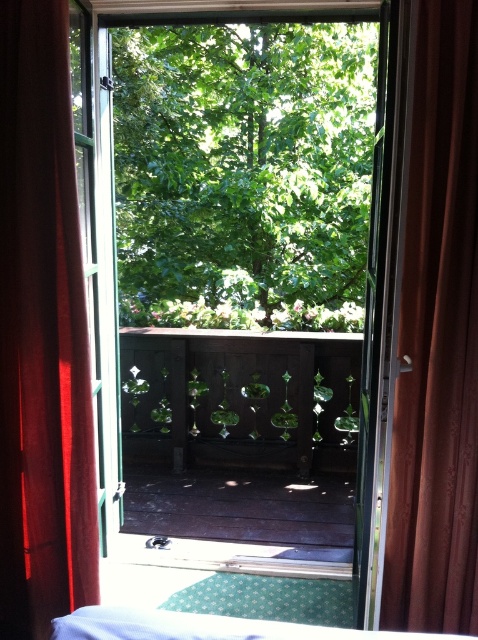
Does point (364, 131) come closer to viewer compared to point (393, 397)?

No, (364, 131) is behind (393, 397).

The image size is (478, 640). In order to click on green leafy tree at center in this screenshot , I will do `click(243, 173)`.

Does green leafy tree at center have a smaller size compared to white fabric bed at lower center?

Incorrect, green leafy tree at center is not smaller in size than white fabric bed at lower center.

Consider the image. Is green leafy tree at center to the left of white fabric bed at lower center from the viewer's perspective?

Correct, you'll find green leafy tree at center to the left of white fabric bed at lower center.

I want to click on green leafy tree at center, so click(x=243, y=173).

Between brown velvet curtain at right and white fabric bed at lower center, which one has less height?

white fabric bed at lower center

The height and width of the screenshot is (640, 478). I want to click on brown velvet curtain at right, so click(435, 330).

Where is `brown velvet curtain at right`? brown velvet curtain at right is located at coordinates (435, 330).